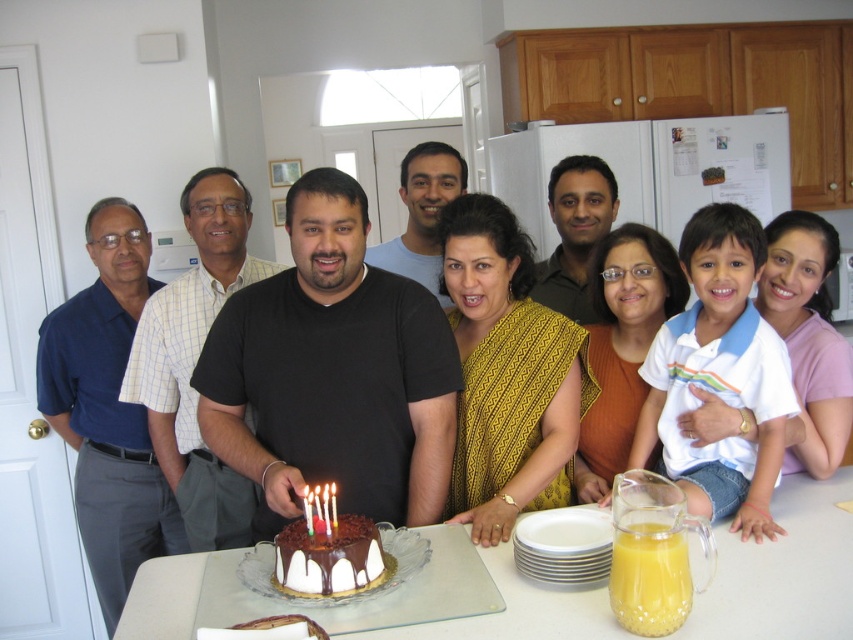
Question: Which is nearer to the white glass table at center?

Choices:
 (A) chocolate frosted cake at center
 (B) translucent glass pitcher at lower right

Answer: (A)

Question: Which is farther from the translucent glass pitcher at lower right?

Choices:
 (A) chocolate frosted cake at center
 (B) matte black shirt at center

Answer: (A)

Question: Does translucent glass pitcher at lower right have a smaller size compared to chocolate frosted cake at center?

Choices:
 (A) no
 (B) yes

Answer: (B)

Question: Is matte black shirt at center to the right of translucent glass pitcher at lower right from the viewer's perspective?

Choices:
 (A) yes
 (B) no

Answer: (A)

Question: Which of the following is the closest to the observer?

Choices:
 (A) chocolate frosted cake at center
 (B) matte black shirt at center
 (C) white glass table at center

Answer: (C)

Question: Is translucent glass pitcher at lower right above chocolate frosted cake at center?

Choices:
 (A) yes
 (B) no

Answer: (A)